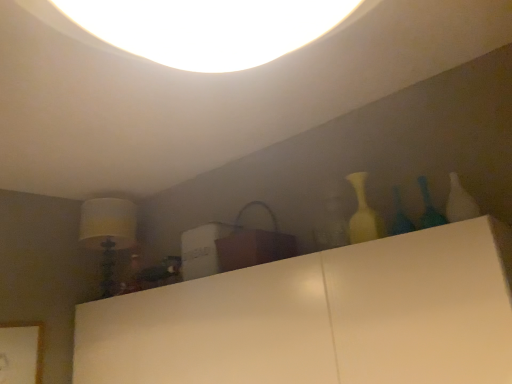
Question: Is translucent glass vase at right, placed as the 2th glass vase when sorted from left to right, shorter than translucent glass vase at upper right, which is the first glass vase in left-to-right order?

Choices:
 (A) no
 (B) yes

Answer: (B)

Question: Does translucent glass vase at right, placed as the 2th glass vase when sorted from left to right, contain translucent glass vase at upper right, which is the first glass vase in left-to-right order?

Choices:
 (A) yes
 (B) no

Answer: (B)

Question: Is translucent glass vase at right, positioned as the 1th glass vase in right-to-left order, taller than translucent glass vase at upper right, which is the first glass vase in left-to-right order?

Choices:
 (A) no
 (B) yes

Answer: (A)

Question: Considering the relative sizes of translucent glass vase at right, placed as the 2th glass vase when sorted from left to right, and translucent glass vase at upper right, marked as the second glass vase in a right-to-left arrangement, in the image provided, is translucent glass vase at right, placed as the 2th glass vase when sorted from left to right, smaller than translucent glass vase at upper right, marked as the second glass vase in a right-to-left arrangement,?

Choices:
 (A) yes
 (B) no

Answer: (A)

Question: Considering the relative sizes of translucent glass vase at right, positioned as the 1th glass vase in right-to-left order, and translucent glass vase at upper right, marked as the second glass vase in a right-to-left arrangement, in the image provided, is translucent glass vase at right, positioned as the 1th glass vase in right-to-left order, bigger than translucent glass vase at upper right, marked as the second glass vase in a right-to-left arrangement,?

Choices:
 (A) no
 (B) yes

Answer: (A)

Question: From their relative heights in the image, would you say translucent glass vase at upper right, which is the first glass vase in left-to-right order, is taller or shorter than translucent glass vase at right, positioned as the 1th glass vase in right-to-left order?

Choices:
 (A) tall
 (B) short

Answer: (A)

Question: Is translucent glass vase at upper right, which is the first glass vase in left-to-right order, spatially inside translucent glass vase at right, positioned as the 1th glass vase in right-to-left order, or outside of it?

Choices:
 (A) outside
 (B) inside

Answer: (A)

Question: In terms of width, does translucent glass vase at upper right, which is the first glass vase in left-to-right order, look wider or thinner when compared to translucent glass vase at right, positioned as the 1th glass vase in right-to-left order?

Choices:
 (A) thin
 (B) wide

Answer: (B)

Question: Visually, is translucent glass vase at upper right, which is the first glass vase in left-to-right order, positioned to the left or to the right of translucent glass vase at right, placed as the 2th glass vase when sorted from left to right?

Choices:
 (A) left
 (B) right

Answer: (A)

Question: Does point (429, 196) appear closer or farther from the camera than point (374, 213)?

Choices:
 (A) farther
 (B) closer

Answer: (B)

Question: From the image's perspective, is translucent glass vase at right, positioned as the 1th glass vase in right-to-left order, located above or below matte white vase at right?

Choices:
 (A) below
 (B) above

Answer: (B)

Question: Is translucent glass vase at right, positioned as the 1th glass vase in right-to-left order, spatially inside matte white vase at right, or outside of it?

Choices:
 (A) inside
 (B) outside

Answer: (B)

Question: Based on their sizes in the image, would you say translucent glass vase at right, placed as the 2th glass vase when sorted from left to right, is bigger or smaller than matte white vase at right?

Choices:
 (A) small
 (B) big

Answer: (A)

Question: In terms of width, does white fabric lampshade at left look wider or thinner when compared to translucent glass vase at upper right, which is the first glass vase in left-to-right order?

Choices:
 (A) wide
 (B) thin

Answer: (A)

Question: From their relative heights in the image, would you say white fabric lampshade at left is taller or shorter than translucent glass vase at upper right, marked as the second glass vase in a right-to-left arrangement?

Choices:
 (A) tall
 (B) short

Answer: (A)